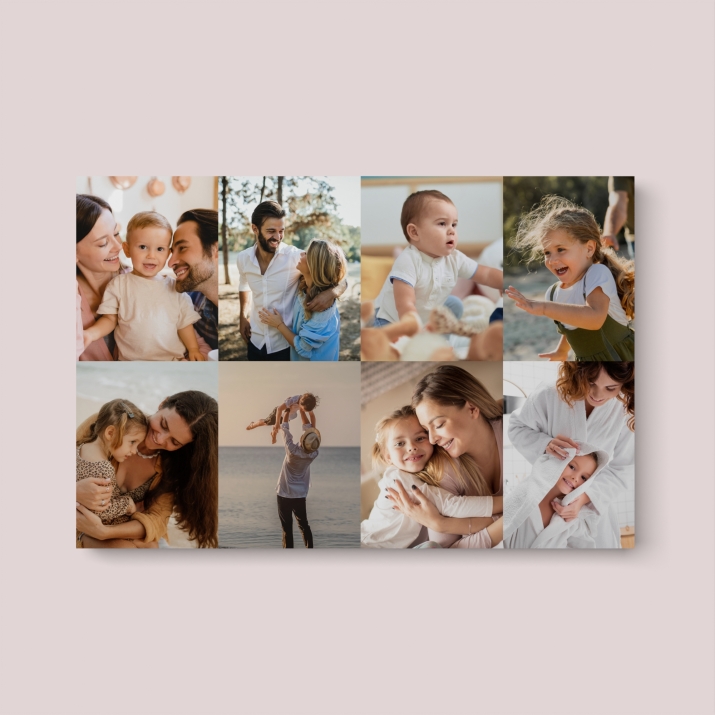
Identify the location of picture box. The image size is (715, 715). (563, 458), (450, 477), (297, 487), (169, 480), (174, 330), (290, 300), (415, 282), (580, 287).